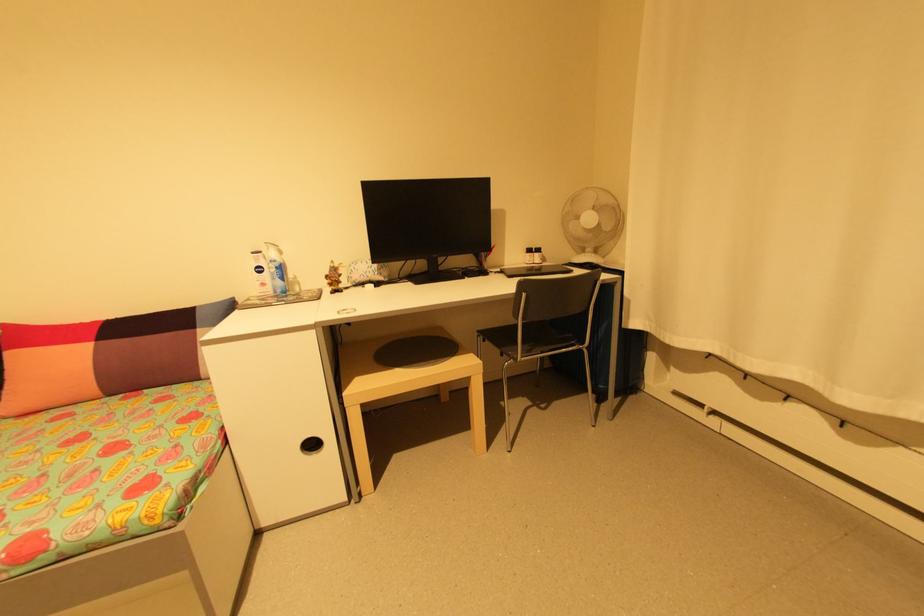
This screenshot has width=924, height=616. Describe the element at coordinates (603, 241) in the screenshot. I see `a white fan button` at that location.